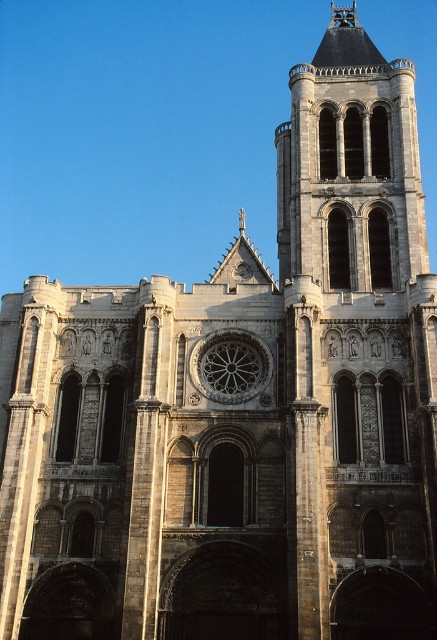
This screenshot has width=437, height=640. What do you see at coordinates (357, 342) in the screenshot?
I see `stone tower at right` at bounding box center [357, 342].

Is stone tower at right below stone rose window at center?

Incorrect, stone tower at right is not positioned below stone rose window at center.

Find the location of `stone tower at right`. stone tower at right is located at coordinates (357, 342).

The width and height of the screenshot is (437, 640). Find the location of `stone tower at right`. stone tower at right is located at coordinates (357, 342).